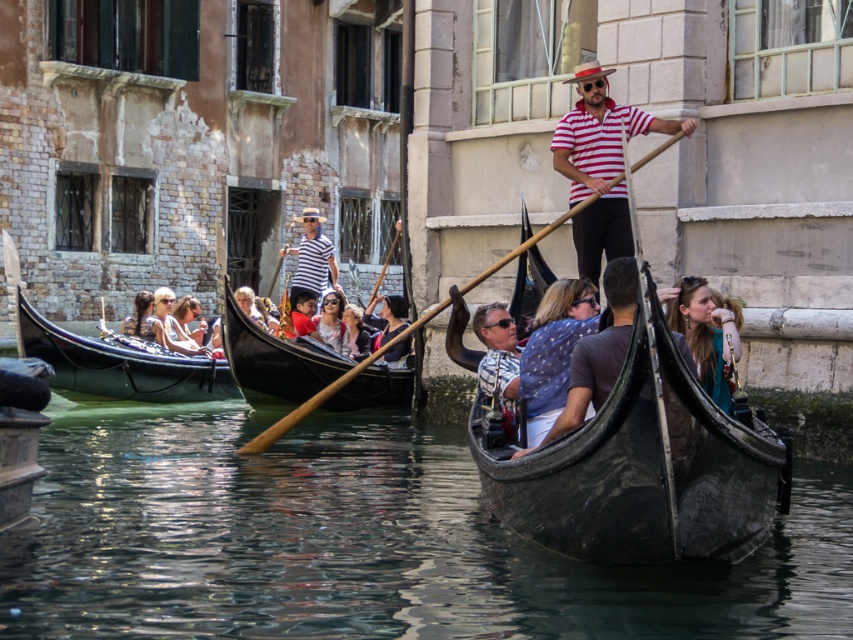
Question: Among these objects, which one is farthest from the camera?

Choices:
 (A) matte blue dress at center
 (B) matte black shirt at center
 (C) striped cotton shirt at center

Answer: (C)

Question: Does light brown wood chair at center come in front of matte pink sunglasses at center?

Choices:
 (A) yes
 (B) no

Answer: (B)

Question: Which point is farther to the camera?

Choices:
 (A) transparent water at lower center
 (B) matte blue shirt at center
 (C) blonde hair at center

Answer: (C)

Question: Does transparent water at lower center appear on the left side of light brown wood chair at center?

Choices:
 (A) no
 (B) yes

Answer: (A)

Question: Is matte blue shirt at center smaller than matte black shirt at center?

Choices:
 (A) no
 (B) yes

Answer: (B)

Question: Which point is farther to the camera?

Choices:
 (A) (526, 349)
 (B) (567, 412)

Answer: (A)